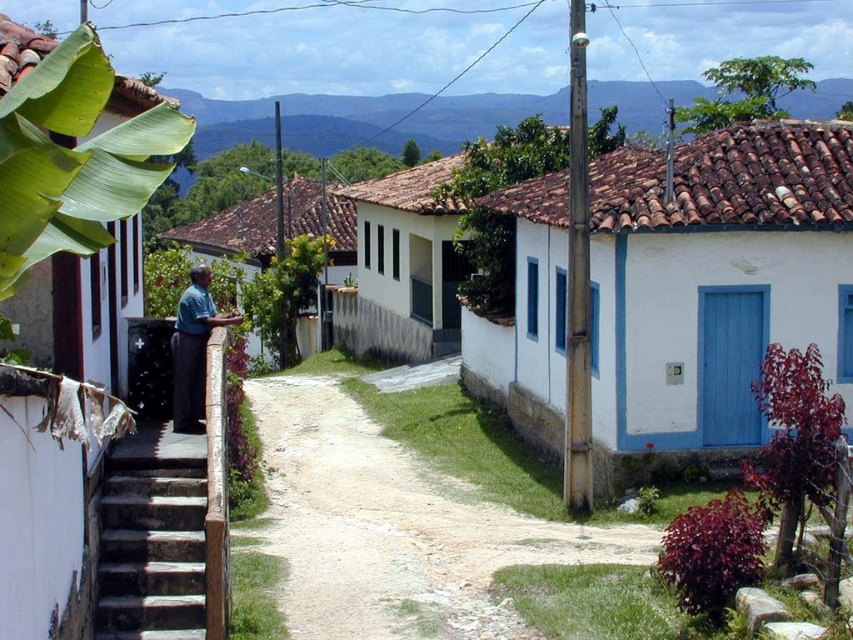
Between dark gray concrete stairs at lower left and dark blue fabric shirt at left, which one is positioned lower?

dark gray concrete stairs at lower left

Does dark gray concrete stairs at lower left have a lesser height compared to dark blue fabric shirt at left?

No, dark gray concrete stairs at lower left is not shorter than dark blue fabric shirt at left.

Describe the element at coordinates (152, 538) in the screenshot. This screenshot has width=853, height=640. I see `dark gray concrete stairs at lower left` at that location.

Find the location of `dark gray concrete stairs at lower left`. dark gray concrete stairs at lower left is located at coordinates 152,538.

Between dirt path at center and dark blue fabric shirt at left, which one is positioned higher?

Positioned higher is dark blue fabric shirt at left.

Locate an element on the screen. dirt path at center is located at coordinates (395, 528).

Which is in front, point (339, 404) or point (196, 282)?

Positioned in front is point (196, 282).

I want to click on dirt path at center, so click(395, 528).

The height and width of the screenshot is (640, 853). Describe the element at coordinates (395, 528) in the screenshot. I see `dirt path at center` at that location.

Can you confirm if dirt path at center is wider than dark gray concrete stairs at lower left?

Correct, the width of dirt path at center exceeds that of dark gray concrete stairs at lower left.

Identify the location of dirt path at center. The height and width of the screenshot is (640, 853). (395, 528).